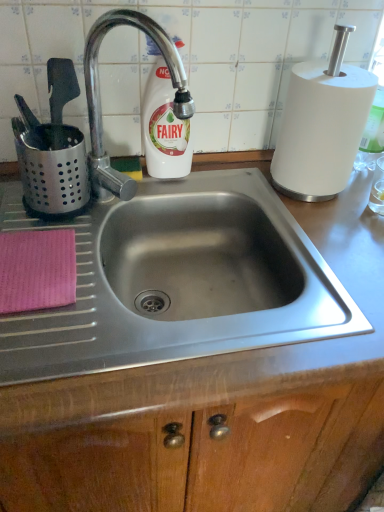
This screenshot has height=512, width=384. Identify the location of vacant area located to the right-hand side of white glossy bottle at upper center. (230, 179).